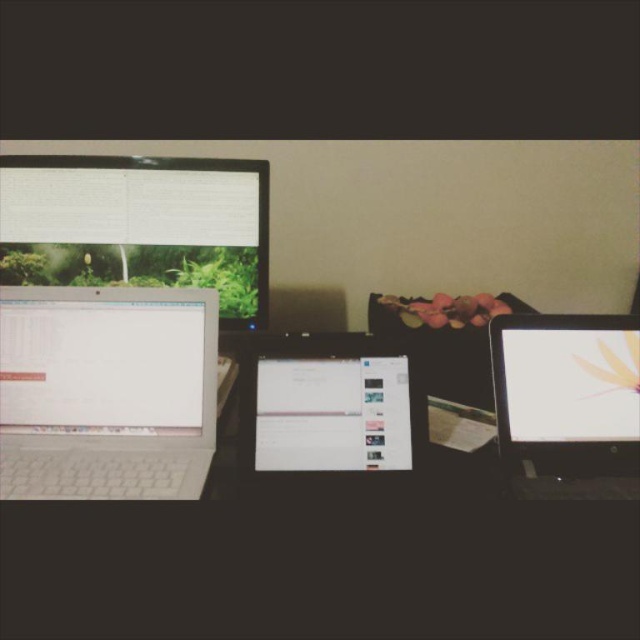
Based on the photo, you are organizing a desk and need to place a new keyboard between the matte plastic monitor at upper left and the white glossy monitor at right. Which monitor should the keyboard be placed closer to if it needs to be aligned with the right edge of the desk?

The keyboard should be placed closer to the white glossy monitor at right since it is positioned on the right side of the matte plastic monitor at upper left, aligning it with the right edge of the desk.

You are organizing the desk and want to place a new phone charger between the white plastic laptop at left and the white glossy tablet at center. Based on their current positions, where should you place the charger relative to the tablet?

The white plastic laptop at left is positioned on the left side of the white glossy tablet at center, so the charger should be placed to the right of the tablet to maintain the left to right order.

You are standing in front of the desk and want to reach the point at coordinates point (24,237). Which direction should you move relative to the point (330,428) to reach it?

To reach point (24,237) from point (330,428), you should move to the left and downward since point (24,237) is behind point (330,428) in the scene.